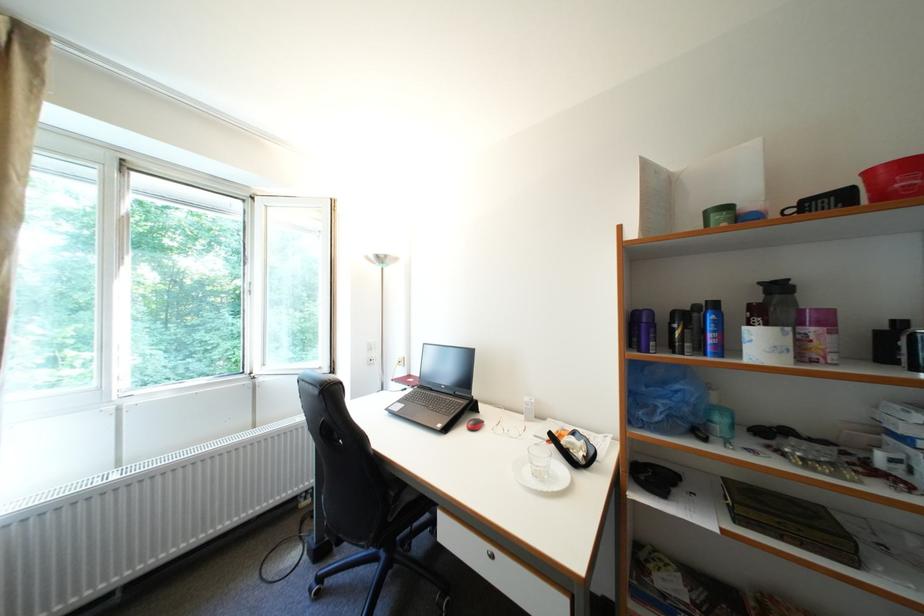
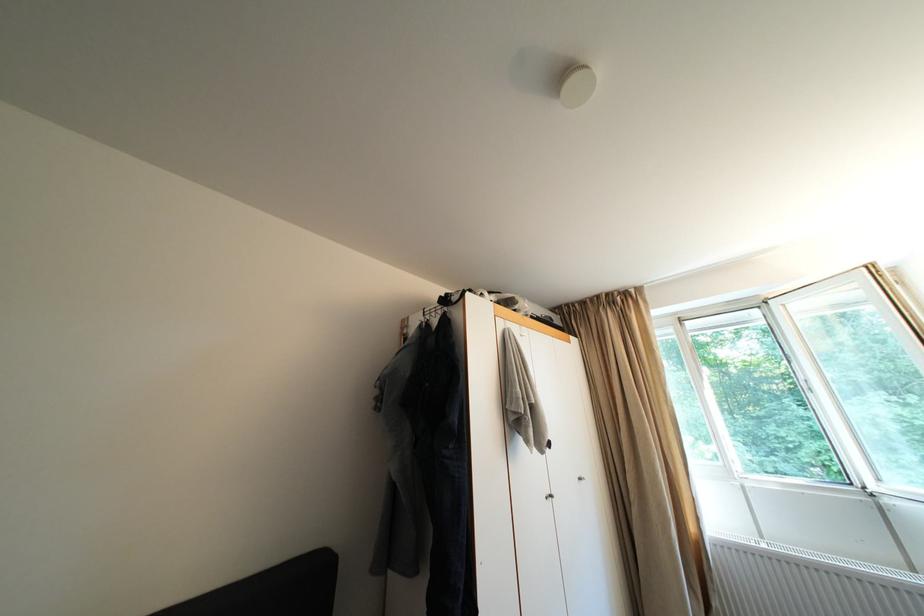
The first image is from the beginning of the video and the second image is from the end. How did the camera likely rotate when shooting the video?

The rotation direction of the camera is left-up.